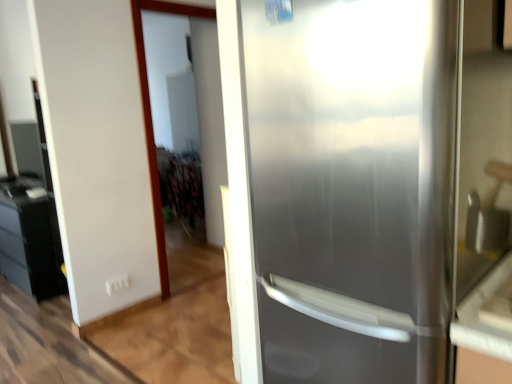
Question: Is satin white screen door at upper left in front of satin silver refrigerator at right?

Choices:
 (A) yes
 (B) no

Answer: (B)

Question: From the image's perspective, is satin white screen door at upper left beneath satin silver refrigerator at right?

Choices:
 (A) no
 (B) yes

Answer: (A)

Question: Is satin white screen door at upper left outside of satin silver refrigerator at right?

Choices:
 (A) no
 (B) yes

Answer: (B)

Question: Is satin white screen door at upper left oriented towards satin silver refrigerator at right?

Choices:
 (A) yes
 (B) no

Answer: (B)

Question: Considering the relative sizes of satin white screen door at upper left and satin silver refrigerator at right in the image provided, is satin white screen door at upper left wider than satin silver refrigerator at right?

Choices:
 (A) yes
 (B) no

Answer: (B)

Question: Is matte black cabinet at left inside or outside of satin white screen door at upper left?

Choices:
 (A) outside
 (B) inside

Answer: (A)

Question: In the image, is matte black cabinet at left positioned in front of or behind satin white screen door at upper left?

Choices:
 (A) behind
 (B) front

Answer: (A)

Question: From a real-world perspective, is matte black cabinet at left physically located above or below satin white screen door at upper left?

Choices:
 (A) above
 (B) below

Answer: (B)

Question: Is matte black cabinet at left bigger or smaller than satin white screen door at upper left?

Choices:
 (A) small
 (B) big

Answer: (B)

Question: Is point (17, 233) positioned closer to the camera than point (256, 66)?

Choices:
 (A) closer
 (B) farther

Answer: (B)

Question: In terms of height, does matte black cabinet at left look taller or shorter compared to satin silver refrigerator at right?

Choices:
 (A) tall
 (B) short

Answer: (B)

Question: In terms of size, does matte black cabinet at left appear bigger or smaller than satin silver refrigerator at right?

Choices:
 (A) small
 (B) big

Answer: (A)

Question: From the image's perspective, is matte black cabinet at left located above or below satin silver refrigerator at right?

Choices:
 (A) above
 (B) below

Answer: (B)

Question: In the image, is satin white screen door at upper left on the left side or the right side of satin silver refrigerator at right?

Choices:
 (A) right
 (B) left

Answer: (B)

Question: From a real-world perspective, is satin white screen door at upper left positioned above or below satin silver refrigerator at right?

Choices:
 (A) above
 (B) below

Answer: (A)